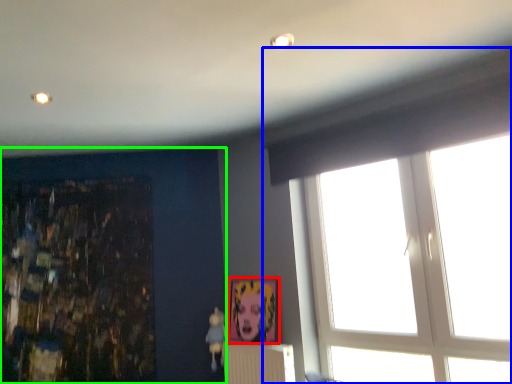
Question: Based on their relative distances, which object is nearer to picture frame (highlighted by a red box)? Choose from window (highlighted by a blue box) and backdrop (highlighted by a green box).

Choices:
 (A) window
 (B) backdrop

Answer: (B)